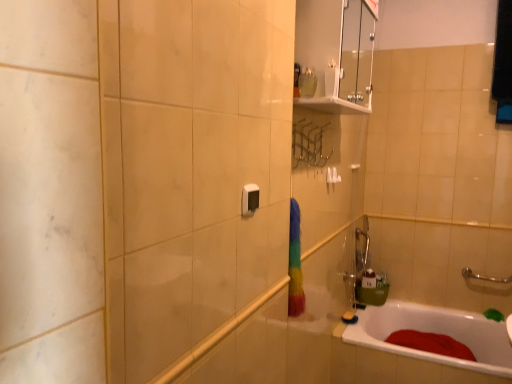
Question: In the image, is satin black switch at center positioned in front of or behind white plastic towel bar at upper center?

Choices:
 (A) behind
 (B) front

Answer: (B)

Question: In terms of size, does satin black switch at center appear bigger or smaller than white plastic towel bar at upper center?

Choices:
 (A) big
 (B) small

Answer: (B)

Question: Based on their relative distances, which object is nearer to the white glossy bathtub at lower right?

Choices:
 (A) transparent glass medicine cabinet at upper center
 (B) white plastic towel bar at upper center
 (C) satin black switch at center

Answer: (B)

Question: Which of these objects is positioned closest to the white glossy bathtub at lower right?

Choices:
 (A) satin black switch at center
 (B) transparent glass medicine cabinet at upper center
 (C) white plastic towel bar at upper center

Answer: (C)